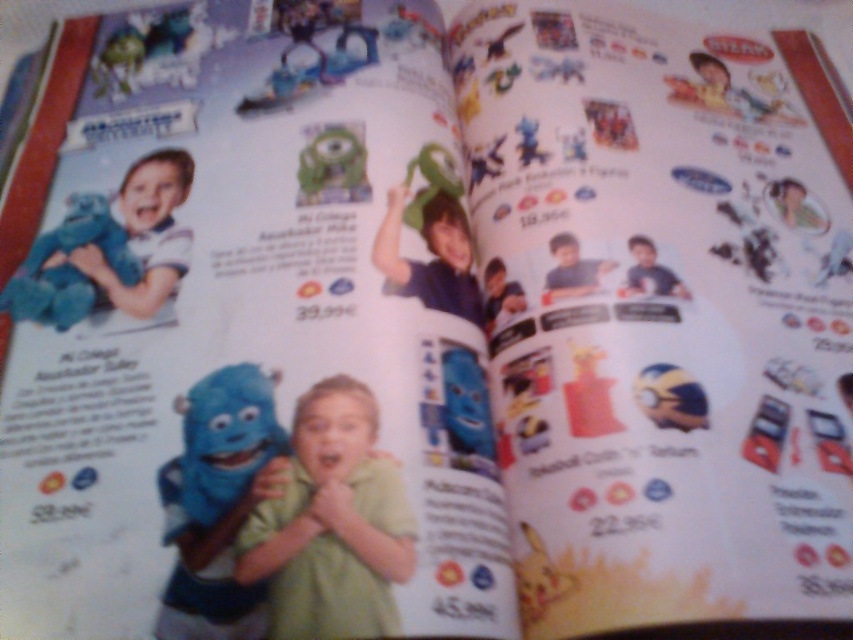
You are a parent looking at a catalog page. You see a matte blue plush at center and a blue plush toy at left. Which one is positioned lower on the page?

The matte blue plush at center is positioned lower on the page than the blue plush toy at left.

You are designing a layout for a children catalog and need to place a new sticker. The sticker must be placed to the right of the matte blue plush at center. Where should you place the sticker?

The sticker should be placed to the right of the matte blue plush at center, which is located at point (218,502). Since the x coordinate is 0.786, placing the sticker at a higher x value would place it to the right.

You are a parent looking at a catalog page and want to find the green matte plush toy at center. Based on the layout described, where should you look on the page?

The green matte plush toy at center is located at point (332, 524), so you should look towards the upper right section of the page since the coordinates indicate it is positioned there.